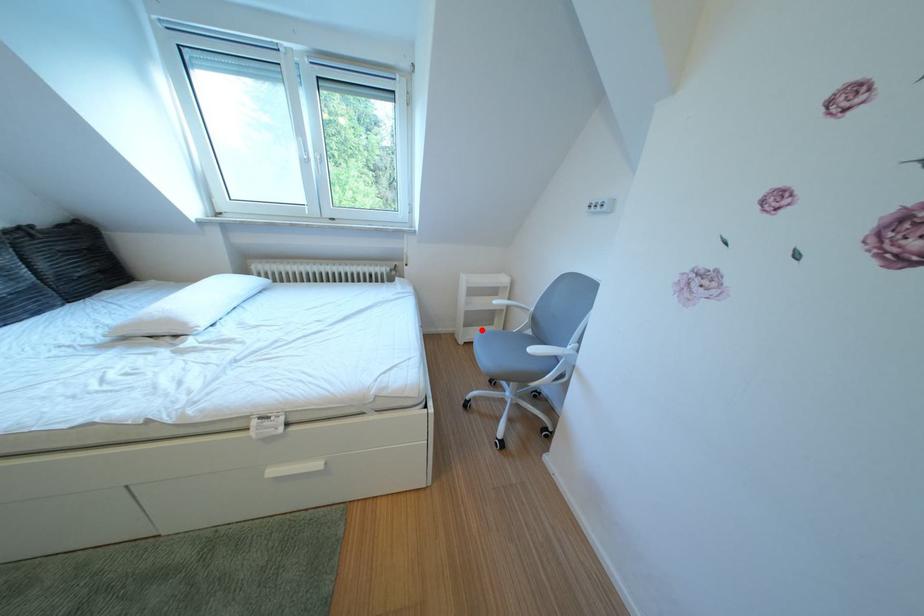
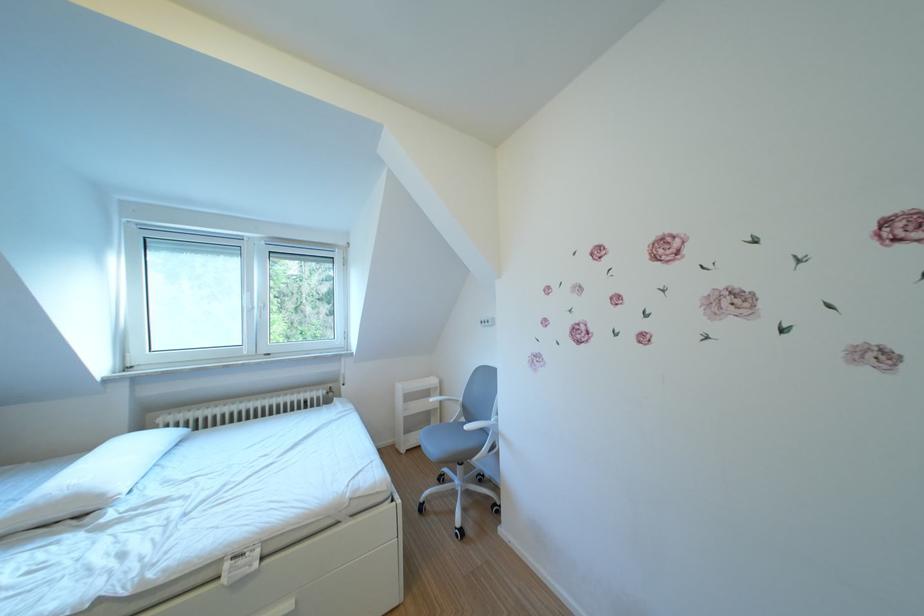
Question: A red point is marked in image1. In image2, is the corresponding 3D point closer to the camera or farther? Reply with the corresponding letter.

Choices:
 (A) The corresponding 3D point is closer.
 (B) The corresponding 3D point is farther.

Answer: (B)